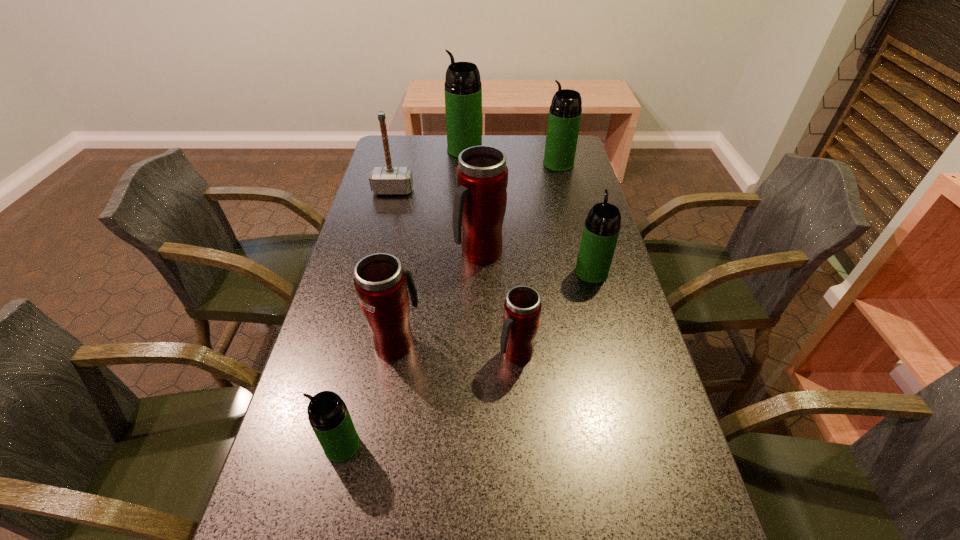
The height and width of the screenshot is (540, 960). I want to click on object that is the seventh closest to the biggest red thermos bottle, so click(328, 415).

Locate which object ranks sixth in proximity to the tallest thermos bottle. Please provide its 2D coordinates. Your answer should be formatted as a tuple, i.e. [(x, y)], where the tuple contains the x and y coordinates of a point satisfying the conditions above.

[(522, 308)]

Identify the location of thermos bottle that stands as the fourth closest to the tallest thermos bottle. (380, 281).

The image size is (960, 540). Find the location of `thermos bottle that is the sixth closest to the third smallest green thermos bottle`. thermos bottle that is the sixth closest to the third smallest green thermos bottle is located at coordinates (328, 415).

At what (x,y) coordinates should I click in order to perform the action: click on green thermos bottle that is the third closest to the leftmost red thermos bottle. Please return your answer as a coordinate pair (x, y). Looking at the image, I should click on (565, 112).

Locate an element on the screen. The width and height of the screenshot is (960, 540). green thermos bottle identified as the third closest to the tallest object is located at coordinates (328, 415).

Select which red thermos bottle appears as the third closest to the second smallest green thermos bottle. Please provide its 2D coordinates. Your answer should be formatted as a tuple, i.e. [(x, y)], where the tuple contains the x and y coordinates of a point satisfying the conditions above.

[(380, 281)]

This screenshot has width=960, height=540. What are the coordinates of `red thermos bottle object that ranks as the third closest to the third biggest green thermos bottle` in the screenshot? It's located at (380, 281).

Where is `free space that satisfies the following two spatial constraints: 1. on the side with the handle of the smallest red thermos bottle; 2. from the spout of the nearest object`? Image resolution: width=960 pixels, height=540 pixels. free space that satisfies the following two spatial constraints: 1. on the side with the handle of the smallest red thermos bottle; 2. from the spout of the nearest object is located at coordinates (523, 446).

The image size is (960, 540). What are the coordinates of `free spot that satisfies the following two spatial constraints: 1. from the spout of the second green thermos bottle from left to right; 2. from the spout of the second smallest green thermos bottle` in the screenshot? It's located at (459, 272).